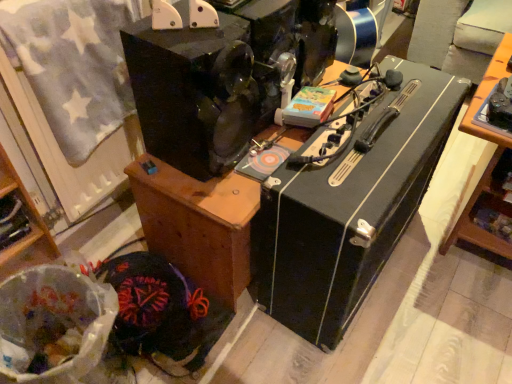
Question: Could you tell me if black matte speaker at center, the 1th furniture from the right, is turned towards wooden cabinet at lower left, marked as the second furniture in a right-to-left arrangement?

Choices:
 (A) yes
 (B) no

Answer: (B)

Question: From the image's perspective, would you say black matte speaker at center, which is the 2th furniture in left-to-right order, is positioned over wooden cabinet at lower left, placed as the first furniture when sorted from left to right?

Choices:
 (A) yes
 (B) no

Answer: (A)

Question: Can wooden cabinet at lower left, placed as the first furniture when sorted from left to right, be found inside black matte speaker at center, which is the 2th furniture in left-to-right order?

Choices:
 (A) no
 (B) yes

Answer: (A)

Question: Is black matte speaker at center, the 1th furniture from the right, positioned in front of wooden cabinet at lower left, marked as the second furniture in a right-to-left arrangement?

Choices:
 (A) yes
 (B) no

Answer: (B)

Question: Can you confirm if black matte speaker at center, which is the 2th furniture in left-to-right order, is taller than wooden cabinet at lower left, placed as the first furniture when sorted from left to right?

Choices:
 (A) yes
 (B) no

Answer: (B)

Question: Would you say black matte speaker at center, which is the 2th furniture in left-to-right order, is to the left or to the right of velvet-like fabric at lower left, which is the first waste in back-to-front order, in the picture?

Choices:
 (A) left
 (B) right

Answer: (B)

Question: Is black matte speaker at center, which is the 2th furniture in left-to-right order, in front of or behind velvet-like fabric at lower left, which is the first waste in back-to-front order, in the image?

Choices:
 (A) front
 (B) behind

Answer: (A)

Question: Is point (187, 241) positioned closer to the camera than point (197, 317)?

Choices:
 (A) farther
 (B) closer

Answer: (B)

Question: From a real-world perspective, is black matte speaker at center, the 1th furniture from the right, above or below velvet-like fabric at lower left, the second waste viewed from the front?

Choices:
 (A) below
 (B) above

Answer: (B)

Question: Relative to velvet-like fabric at lower left, the second waste viewed from the front, is wooden cabinet at lower left, marked as the second furniture in a right-to-left arrangement, in front or behind?

Choices:
 (A) front
 (B) behind

Answer: (A)

Question: In terms of width, does wooden cabinet at lower left, marked as the second furniture in a right-to-left arrangement, look wider or thinner when compared to velvet-like fabric at lower left, the second waste viewed from the front?

Choices:
 (A) wide
 (B) thin

Answer: (B)

Question: Does point (33, 210) appear closer or farther from the camera than point (208, 327)?

Choices:
 (A) closer
 (B) farther

Answer: (A)

Question: From a real-world perspective, relative to velvet-like fabric at lower left, which is the first waste in back-to-front order, is wooden cabinet at lower left, marked as the second furniture in a right-to-left arrangement, vertically above or below?

Choices:
 (A) below
 (B) above

Answer: (B)

Question: Is point [x=330, y=148] closer or farther from the camera than point [x=158, y=352]?

Choices:
 (A) closer
 (B) farther

Answer: (A)

Question: Is black hard case at center inside or outside of velvet-like fabric at lower left, which is the first waste in back-to-front order?

Choices:
 (A) outside
 (B) inside

Answer: (A)